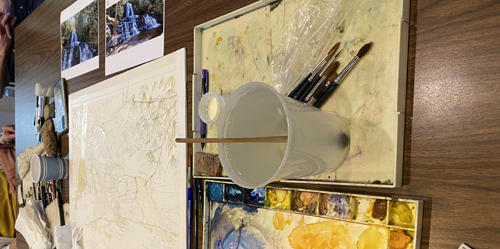
This screenshot has height=249, width=500. Identify the location of paints. (214, 192), (229, 195), (255, 199), (283, 200), (304, 204), (334, 208), (369, 212), (398, 214), (402, 241).